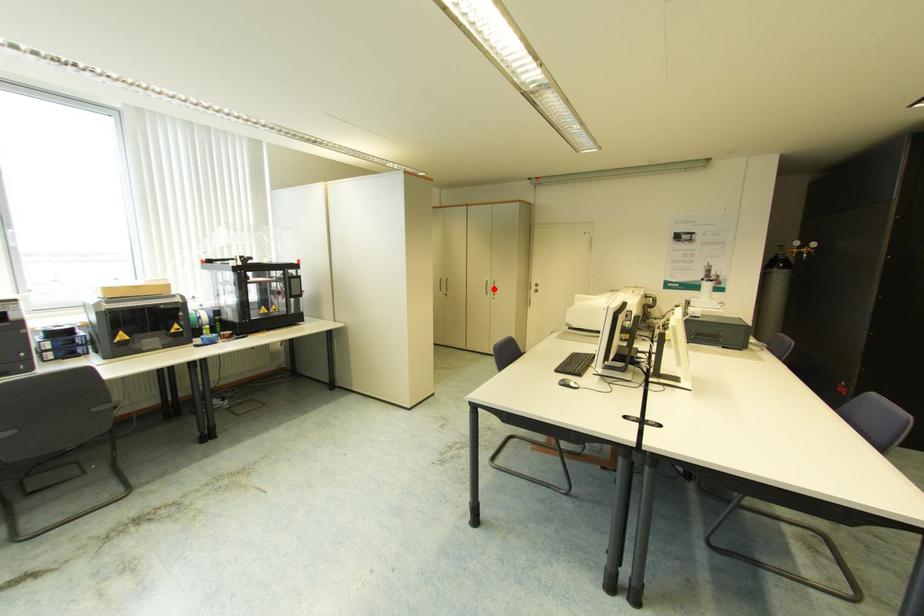
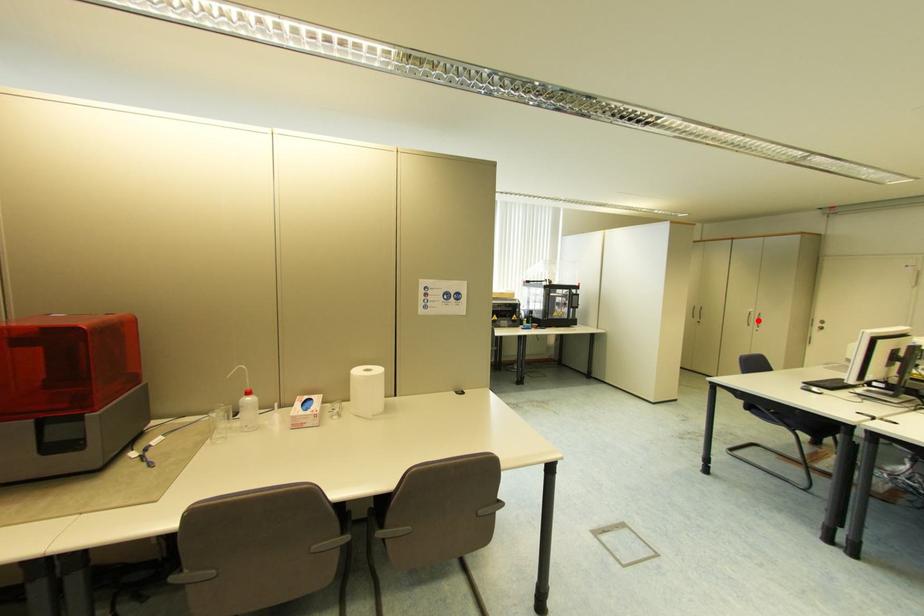
I am providing you with two images of the same scene from different viewpoints. A red point is marked on the first image and another point is marked on the second image. Do the highlighted points in image1 and image2 indicate the same real-world spot?

Yes